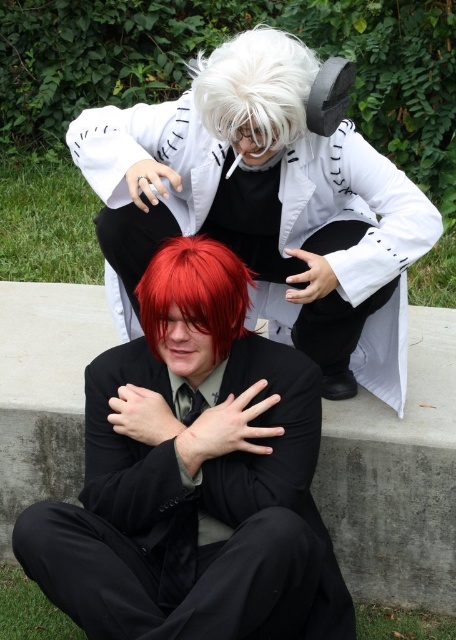
Is white matte coat at upper center positioned before shiny red wig at center?

Yes, white matte coat at upper center is closer to the viewer.

Does white matte coat at upper center appear on the left side of shiny red wig at center?

In fact, white matte coat at upper center is to the right of shiny red wig at center.

Between point (306, 84) and point (141, 282), which one is positioned behind?

The point (141, 282) is more distant.

I want to click on white matte coat at upper center, so click(265, 208).

Does white fluffy wig at upper center come behind shiny red wig at center?

No, white fluffy wig at upper center is closer to the viewer.

Is white fluffy wig at upper center bigger than shiny red wig at center?

No.

The width and height of the screenshot is (456, 640). Describe the element at coordinates (255, 90) in the screenshot. I see `white fluffy wig at upper center` at that location.

Locate an element on the screen. Image resolution: width=456 pixels, height=640 pixels. white fluffy wig at upper center is located at coordinates [x=255, y=90].

Who is shorter, white matte coat at upper center or white fluffy wig at upper center?

white fluffy wig at upper center

Can you confirm if white matte coat at upper center is smaller than white fluffy wig at upper center?

No.

Which is behind, point (398, 349) or point (265, 44)?

The point (398, 349) is behind.

You are a GUI agent. You are given a task and a screenshot of the screen. Output one action in this format:
    pyautogui.click(x=<x>, y=<y>)
    Task: Click on the white matte coat at upper center
    This screenshot has height=640, width=456.
    Given the screenshot: What is the action you would take?
    pyautogui.click(x=265, y=208)